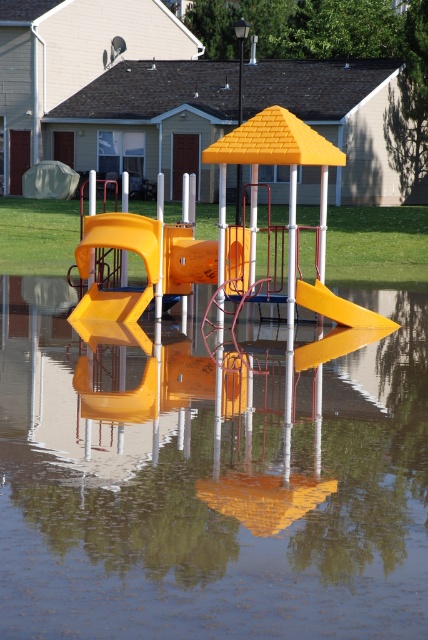
Between transparent plastic water at center and yellow matte slide at center, which one appears on the right side from the viewer's perspective?

From the viewer's perspective, yellow matte slide at center appears more on the right side.

Which is in front, point (2, 486) or point (345, 301)?

Positioned in front is point (2, 486).

Find the location of a particular element. transparent plastic water at center is located at coordinates (211, 484).